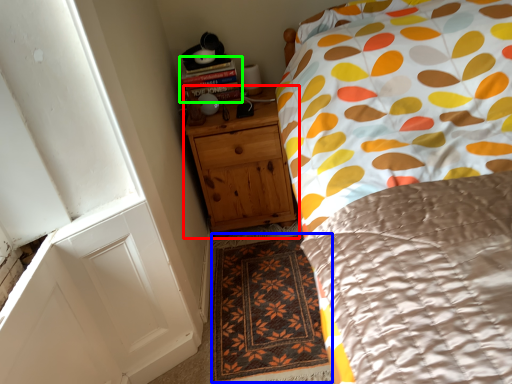
Question: Based on their relative distances, which object is nearer to chest of drawers (highlighted by a red box)? Choose from doormat (highlighted by a blue box) and book (highlighted by a green box).

Choices:
 (A) doormat
 (B) book

Answer: (B)